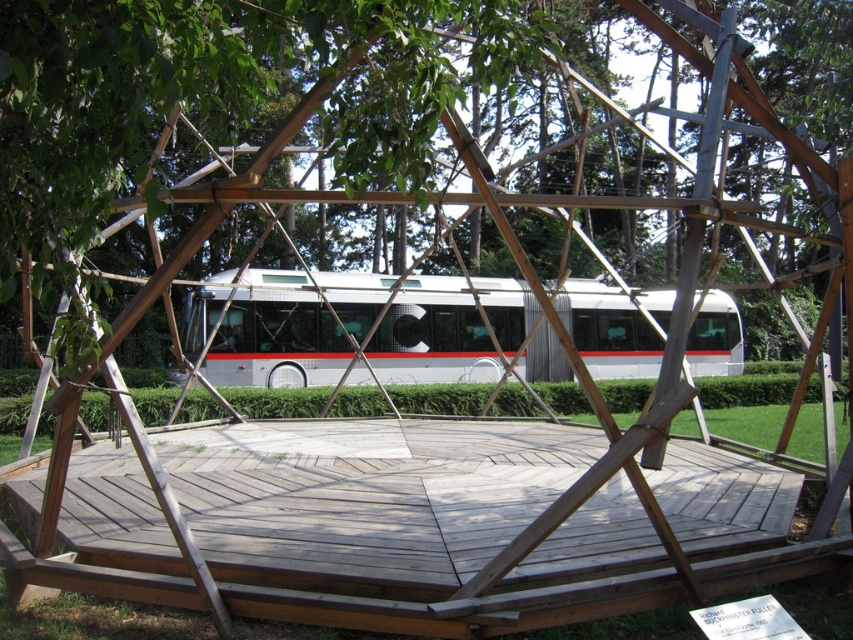
Looking at this image, you are standing at the center of the wooden structure and want to take a photo of the green leafy tree at center. Which direction should you face to capture it in the frame?

The green leafy tree at center is located at coordinates 0.144 on the x and 0.249 on the y axis, so you should face towards the lower left direction to capture it in the frame.